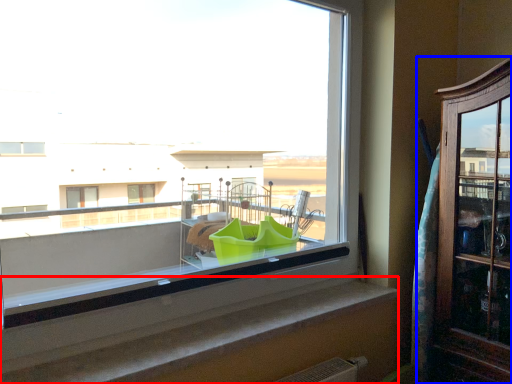
Question: Which of the following is the closest to the observer, window sill (highlighted by a red box) or dresser (highlighted by a blue box)?

Choices:
 (A) window sill
 (B) dresser

Answer: (A)